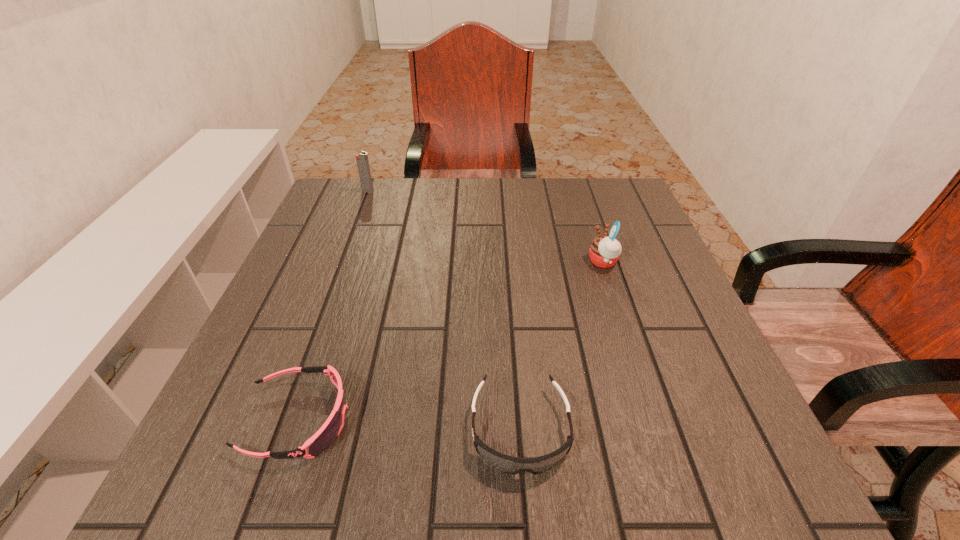
Identify the location of the farthest object. tap(362, 161).

Find the location of `the rightmost object`. the rightmost object is located at coordinates (605, 251).

At what (x,y) coordinates should I click in order to perform the action: click on the third nearest object. Please return your answer as a coordinate pair (x, y). Image resolution: width=960 pixels, height=540 pixels. Looking at the image, I should click on (605, 251).

Where is `the left goggles`? The width and height of the screenshot is (960, 540). the left goggles is located at coordinates pyautogui.click(x=323, y=438).

You are a GUI agent. You are given a task and a screenshot of the screen. Output one action in this format:
    pyautogui.click(x=<x>, y=<y>)
    Task: Click on the right goggles
    
    Given the screenshot: What is the action you would take?
    pyautogui.click(x=512, y=465)

This screenshot has height=540, width=960. What are the coordinates of `free location located on the right of the igniter` in the screenshot? It's located at (501, 191).

What are the coordinates of `vacant position located 0.390m on the front-facing side of the muffin` in the screenshot? It's located at (417, 262).

This screenshot has width=960, height=540. Identify the location of vacant space situated 0.090m on the front-facing side of the muffin. tap(548, 262).

At what (x,y) coordinates should I click in order to perform the action: click on vacant region located on the front-facing side of the muffin. Please return your answer as a coordinate pair (x, y). This screenshot has height=540, width=960. Looking at the image, I should click on (553, 262).

Identify the location of blank area located on the front-facing side of the left goggles. (487, 420).